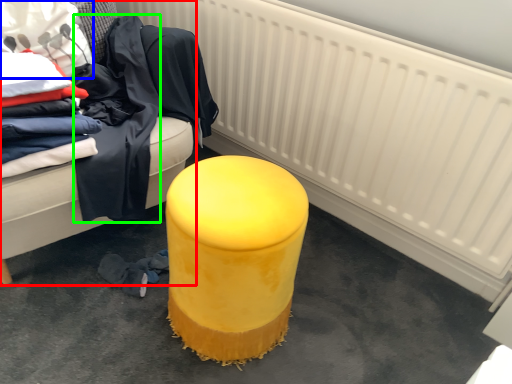
Question: Which is nearer to the furniture (highlighted by a red box)? clothing (highlighted by a blue box) or clothing (highlighted by a green box).

Choices:
 (A) clothing
 (B) clothing

Answer: (B)